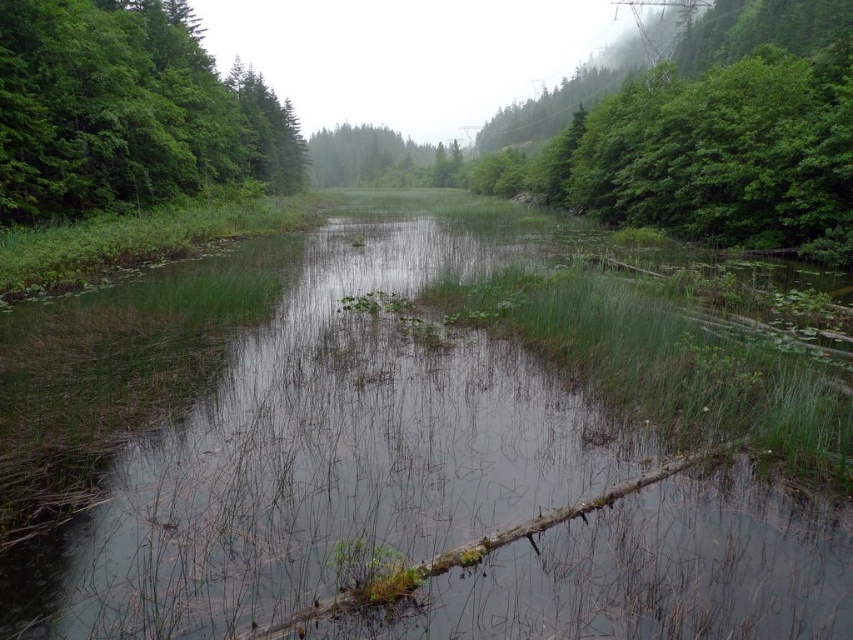
Question: Among these objects, which one is farthest from the camera?

Choices:
 (A) green leafy tree at upper right
 (B) green leafy tree at left

Answer: (A)

Question: Which object is the farthest from the green leafy tree at center?

Choices:
 (A) green leafy tree at left
 (B) green leafy tree at upper right

Answer: (A)

Question: Which point is closer to the camera?

Choices:
 (A) (138, 131)
 (B) (358, 147)

Answer: (A)

Question: Observing the image, what is the correct spatial positioning of green grassy stream at center in reference to green leafy tree at left?

Choices:
 (A) right
 (B) left

Answer: (A)

Question: Considering the relative positions of green leafy tree at left and green leafy tree at center in the image provided, where is green leafy tree at left located with respect to green leafy tree at center?

Choices:
 (A) right
 (B) left

Answer: (B)

Question: Can you confirm if green leafy tree at upper right is positioned below green leafy tree at center?

Choices:
 (A) yes
 (B) no

Answer: (A)